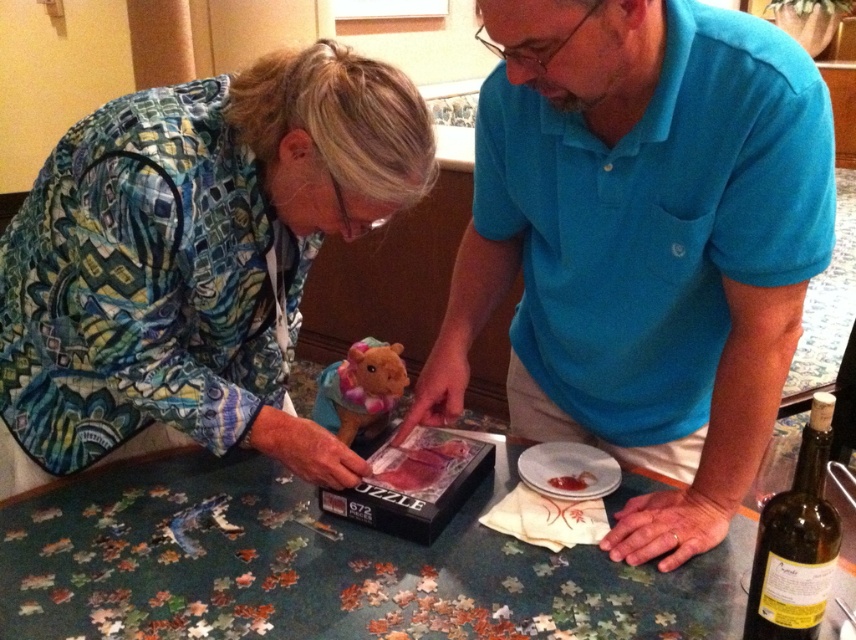
Question: Among these points, which one is nearest to the camera?

Choices:
 (A) (88, 634)
 (B) (402, 378)
 (C) (556, 480)
 (D) (348, 125)

Answer: (A)

Question: Which of these objects is positioned closest to the translucent glass bottle at lower right?

Choices:
 (A) smooth red sauce at lower center
 (B) wooden puzzle pieces at center
 (C) velvety plush hamster at center
 (D) printed fabric shirt at lower left

Answer: (A)

Question: Is wooden puzzle pieces at center thinner than velvety plush hamster at center?

Choices:
 (A) yes
 (B) no

Answer: (B)

Question: In this image, where is blue cotton shirt at upper right located relative to velvety plush hamster at center?

Choices:
 (A) left
 (B) right

Answer: (B)

Question: Which point is farther to the camera?

Choices:
 (A) wooden puzzle pieces at center
 (B) velvety plush hamster at center
 (C) translucent glass bottle at lower right
 (D) blue cotton shirt at upper right

Answer: (B)

Question: Is velvety plush hamster at center above smooth red sauce at lower center?

Choices:
 (A) no
 (B) yes

Answer: (B)